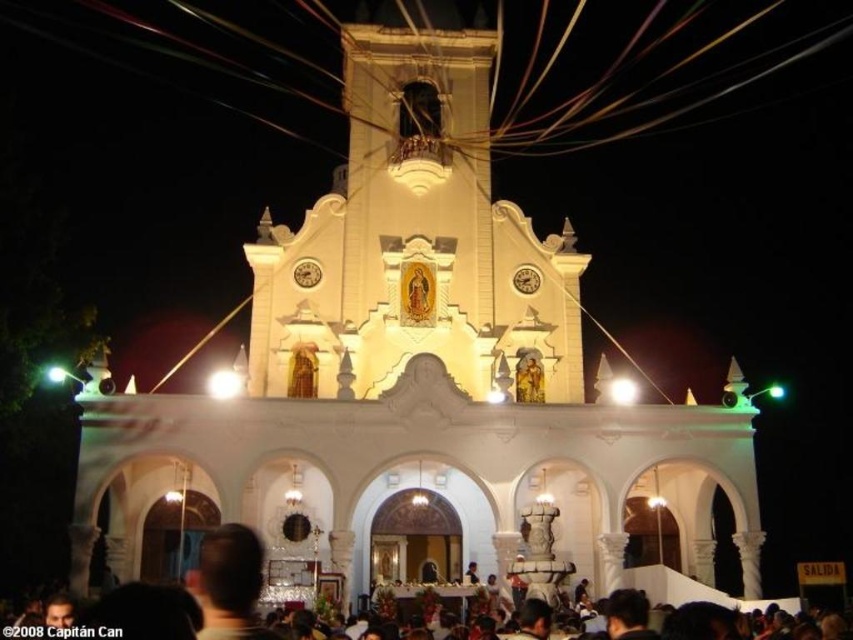
You are standing at the entrance of the church and want to hang a decoration from the metallic wire at upper center. However, there is a black matte crowd at lower center below it. Can you safely hang the decoration without it falling onto the crowd?

The metallic wire at upper center is above the black matte crowd at lower center, so hanging the decoration from the metallic wire at upper center would keep it safely out of reach of the crowd below.

You are a photographer standing at the entrance of the church, and you want to capture both the metallic wire at upper center and the black matte crowd at lower center in your photo. Which object is higher in the frame?

The metallic wire at upper center is higher in the frame than the black matte crowd at lower center because it has a greater height compared to it.